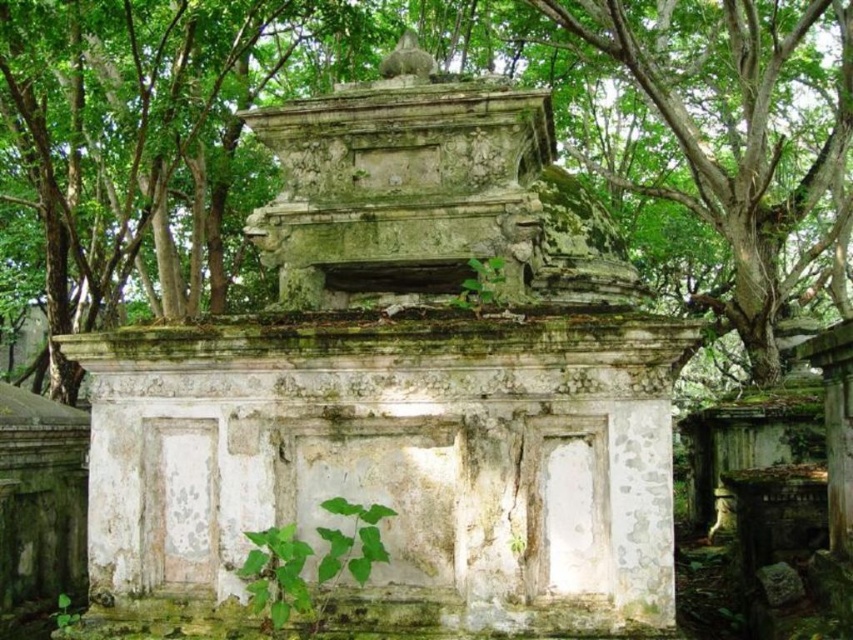
You are standing in front of the aged stone structure and notice two green leafy plants. Which one, the green leafy tree at upper right or the green leafy plant at lower center, is positioned higher up in the scene?

The green leafy tree at upper right is positioned higher up in the scene than the green leafy plant at lower center.

You are an archaeologist examining the tomb and notice the green leafy tree at upper right and the green leafy plant at lower center. Which of these two has a thicker trunk or stem?

The green leafy plant at lower center has a thicker trunk or stem than the green leafy tree at upper right.